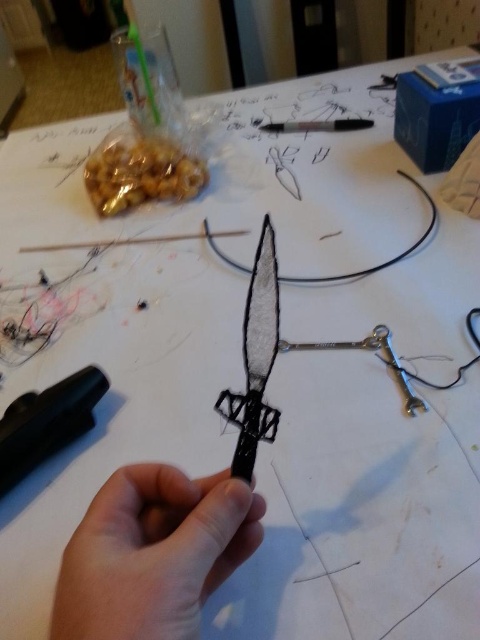
Does black matte knife at center have a smaller size compared to black rubber pen at center?

No, black matte knife at center is not smaller than black rubber pen at center.

Does black matte knife at center appear under black rubber pen at center?

No, black matte knife at center is not below black rubber pen at center.

Who is more distant from viewer, (248, 368) or (57, 436)?

Point (57, 436)

Locate an element on the screen. The width and height of the screenshot is (480, 640). black matte knife at center is located at coordinates (255, 358).

Can you confirm if smooth skin hand at center is positioned below black matte knife at center?

Yes.

Which is behind, point (164, 496) or point (254, 275)?

Positioned behind is point (254, 275).

I want to click on smooth skin hand at center, so click(153, 554).

Is black matte knife at center to the left of metallic silver scissors at center from the viewer's perspective?

Indeed, black matte knife at center is positioned on the left side of metallic silver scissors at center.

Does black matte knife at center have a larger size compared to metallic silver scissors at center?

Indeed, black matte knife at center has a larger size compared to metallic silver scissors at center.

Where is `black matte knife at center`? Image resolution: width=480 pixels, height=640 pixels. black matte knife at center is located at coordinates (255, 358).

You are a GUI agent. You are given a task and a screenshot of the screen. Output one action in this format:
    pyautogui.click(x=<x>, y=<y>)
    Task: Click on the black matte knife at center
    
    Given the screenshot: What is the action you would take?
    pyautogui.click(x=255, y=358)